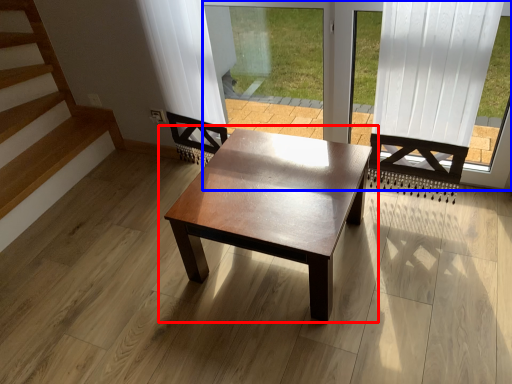
Question: Among these objects, which one is nearest to the camera, coffee table (highlighted by a red box) or window frame (highlighted by a blue box)?

Choices:
 (A) coffee table
 (B) window frame

Answer: (B)